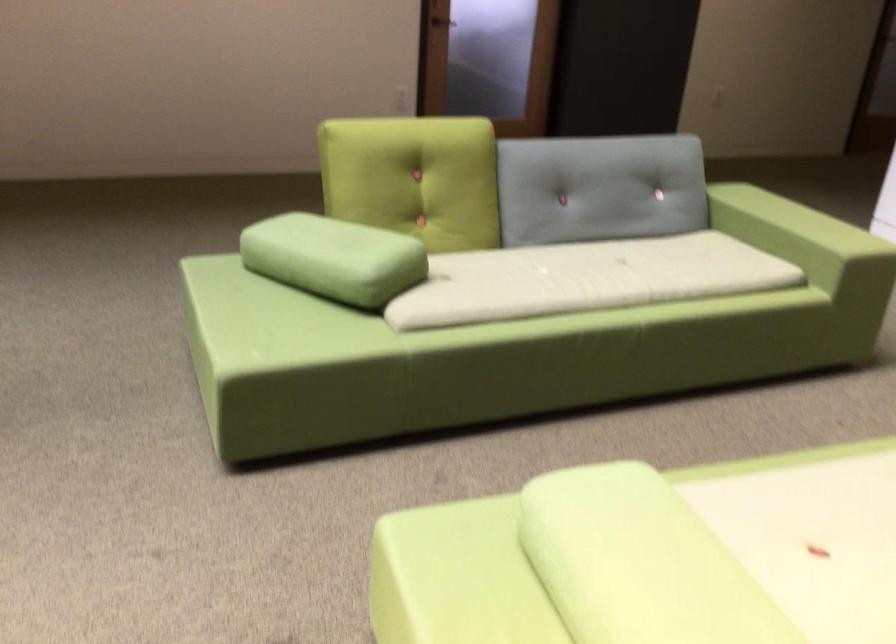
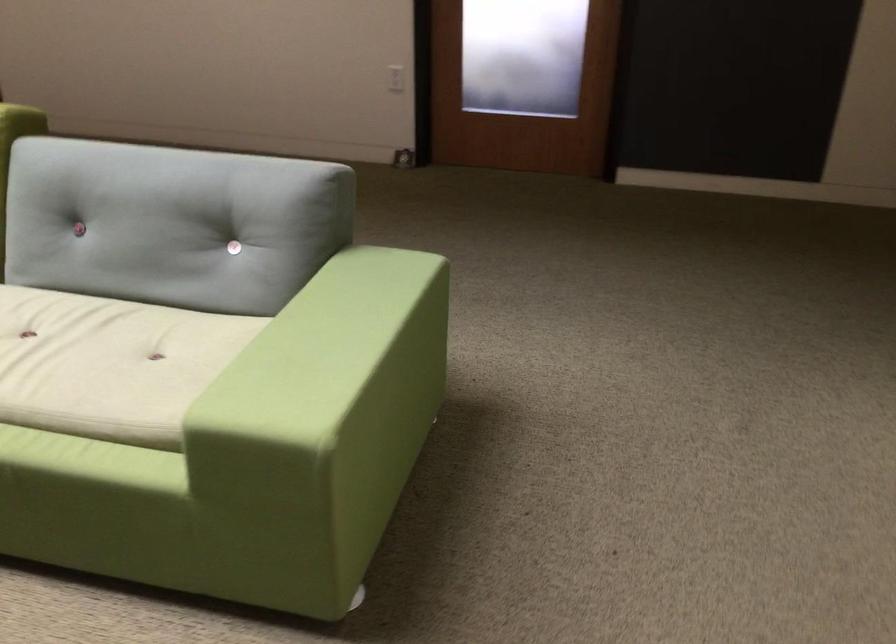
In the second image, find the point that corresponds to point (812, 221) in the first image.

(323, 353)